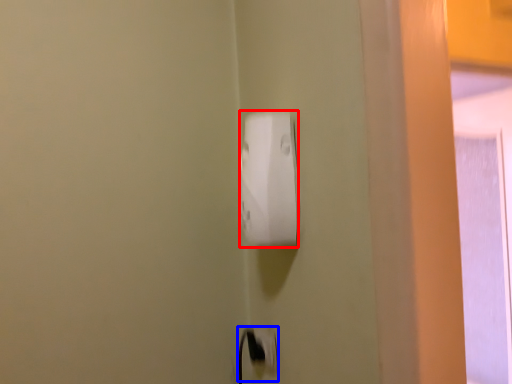
Question: Which point is further to the camera, power plugs and sockets (highlighted by a red box) or electric outlet (highlighted by a blue box)?

Choices:
 (A) power plugs and sockets
 (B) electric outlet

Answer: (B)